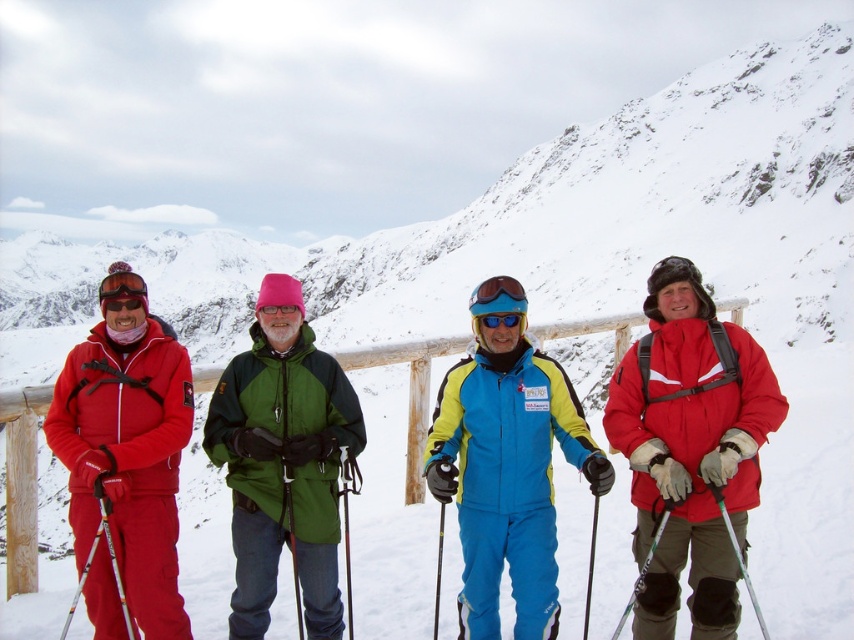
Does matte black goggles at left appear on the left side of metallic silver ski pole at lower right?

Indeed, matte black goggles at left is positioned on the left side of metallic silver ski pole at lower right.

Where is `matte black goggles at left`? The height and width of the screenshot is (640, 854). matte black goggles at left is located at coordinates (121, 285).

Does green matte jacket at center have a greater width compared to blue matte goggles at center?

Yes.

Consider the image. Between green matte jacket at center and blue matte goggles at center, which one has more height?

green matte jacket at center is taller.

Describe the element at coordinates (284, 460) in the screenshot. I see `green matte jacket at center` at that location.

Image resolution: width=854 pixels, height=640 pixels. I want to click on green matte jacket at center, so click(284, 460).

Can you confirm if blue matte goggles at center is smaller than metallic silver ski pole at lower right?

Incorrect, blue matte goggles at center is not smaller in size than metallic silver ski pole at lower right.

Does blue matte goggles at center appear over metallic silver ski pole at lower right?

Yes.

Where is `blue matte goggles at center`? blue matte goggles at center is located at coordinates (496, 296).

Identify the location of blue matte goggles at center. (496, 296).